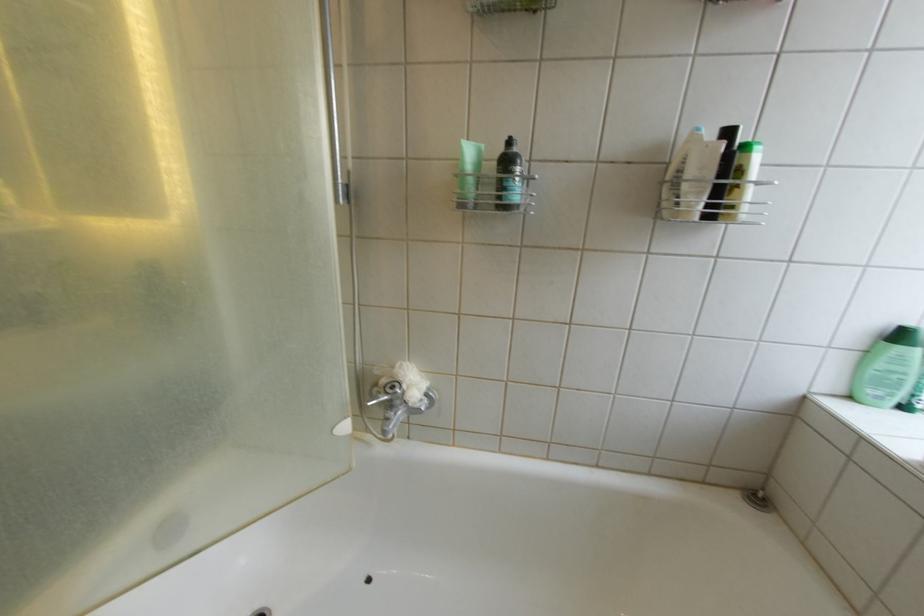
Locate an element on the screen. The image size is (924, 616). light green bottle is located at coordinates (889, 368).